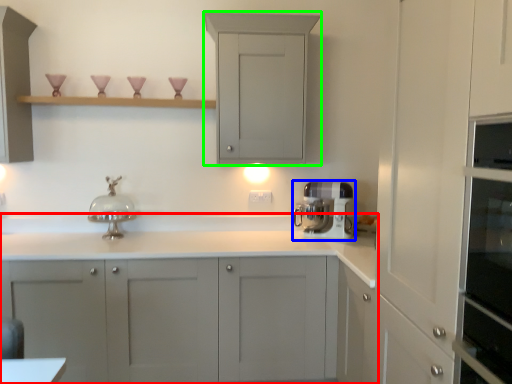
Question: Considering the real-world distances, which object is closest to cabinetry (highlighted by a red box)? home appliance (highlighted by a blue box) or cabinetry (highlighted by a green box).

Choices:
 (A) home appliance
 (B) cabinetry

Answer: (A)